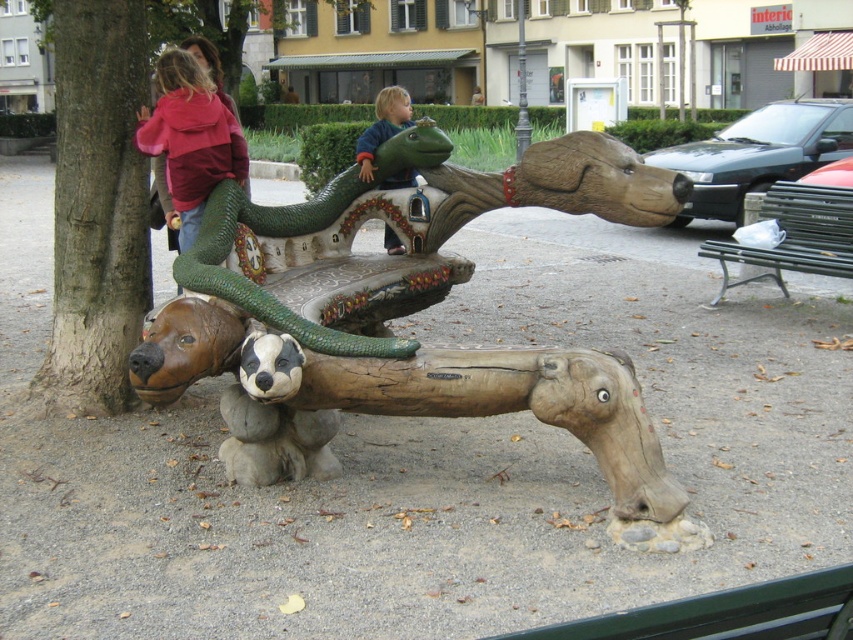
You are a parent trying to decide where to place a new 1.2 meter wide storage box. The wooden bench at center and the matte pink hoodie at upper left are in the area. Which object has enough space to place the storage box next to it without overlapping?

The wooden bench at center is wider than the matte pink hoodie at upper left, so placing the storage box next to the wooden bench at center would provide sufficient space as it is wider.

You are at a park and need to sit down. You see a wooden bench at center and a metallic silver bench at right. Which bench is closer to the left side of the park?

The wooden bench at center is to the left of the metallic silver bench at right, so the wooden bench at center is closer to the left side of the park.

You are a parent looking for a place to sit while watching your child play on the dragon structure. You see a wooden bench at center and a matte pink hoodie at upper left. Which object would be more suitable for sitting?

The wooden bench at center is taller than the matte pink hoodie at upper left, so the wooden bench at center is more suitable for sitting.